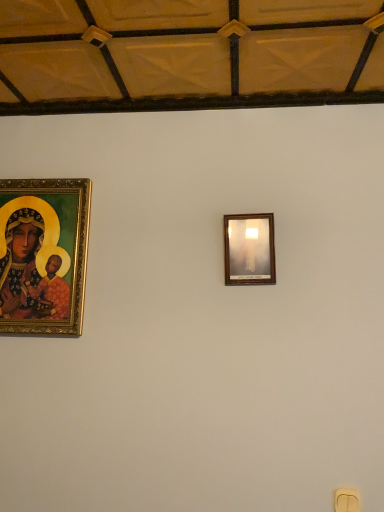
Question: Considering the relative positions of wooden picture frame at upper center and yellow plastic light switch at lower right in the image provided, is wooden picture frame at upper center to the left or to the right of yellow plastic light switch at lower right?

Choices:
 (A) left
 (B) right

Answer: (A)

Question: Is wooden picture frame at upper center in front of or behind yellow plastic light switch at lower right in the image?

Choices:
 (A) behind
 (B) front

Answer: (A)

Question: Which is nearer to the wooden picture frame at upper center?

Choices:
 (A) yellow plastic light switch at lower right
 (B) gold-framed painting at left

Answer: (B)

Question: Which of these objects is positioned closest to the wooden picture frame at upper center?

Choices:
 (A) yellow plastic light switch at lower right
 (B) gold-framed painting at left

Answer: (B)